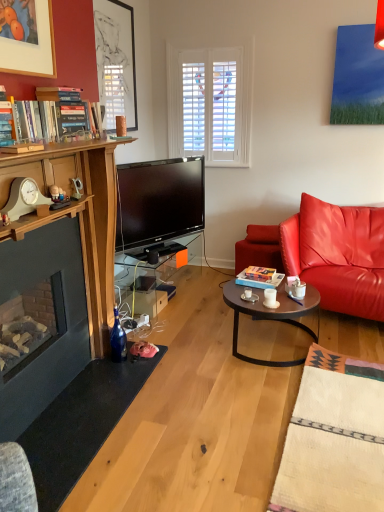
Question: Can you confirm if transparent glass table at center is bigger than hardcover book at center, the first book when ordered from bottom to top?

Choices:
 (A) no
 (B) yes

Answer: (B)

Question: Is transparent glass table at center taller than hardcover book at center, acting as the first book starting from the right?

Choices:
 (A) yes
 (B) no

Answer: (A)

Question: Is transparent glass table at center not inside hardcover book at center, which is the 2th book from front to back?

Choices:
 (A) yes
 (B) no

Answer: (A)

Question: Is transparent glass table at center to the left of hardcover book at center, marked as the 2th book in a top-to-bottom arrangement, from the viewer's perspective?

Choices:
 (A) no
 (B) yes

Answer: (B)

Question: From the image's perspective, is transparent glass table at center below hardcover book at center, the first book when ordered from bottom to top?

Choices:
 (A) yes
 (B) no

Answer: (B)

Question: Is blue glass bottle at lower left bigger or smaller than transparent glass table at center?

Choices:
 (A) big
 (B) small

Answer: (B)

Question: Is blue glass bottle at lower left wider or thinner than transparent glass table at center?

Choices:
 (A) thin
 (B) wide

Answer: (A)

Question: Would you say blue glass bottle at lower left is to the left or to the right of transparent glass table at center in the picture?

Choices:
 (A) left
 (B) right

Answer: (A)

Question: Is point click(115, 310) positioned closer to the camera than point click(160, 242)?

Choices:
 (A) closer
 (B) farther

Answer: (A)

Question: From a real-world perspective, is white wooden clock at left above or below hardcover books at left, positioned as the 2th book in right-to-left order?

Choices:
 (A) below
 (B) above

Answer: (A)

Question: From the image's perspective, is white wooden clock at left positioned above or below hardcover books at left, which appears as the first book when viewed from the left?

Choices:
 (A) above
 (B) below

Answer: (B)

Question: Does point (13, 186) appear closer or farther from the camera than point (46, 123)?

Choices:
 (A) closer
 (B) farther

Answer: (A)

Question: In the image, is white wooden clock at left positioned in front of or behind hardcover books at left, positioned as the 2th book in right-to-left order?

Choices:
 (A) behind
 (B) front

Answer: (B)

Question: Is blue glass bottle at lower left situated inside hardcover book at center, which is the 2th book in left-to-right order, or outside?

Choices:
 (A) outside
 (B) inside

Answer: (A)

Question: From the image's perspective, is blue glass bottle at lower left above or below hardcover book at center, acting as the first book starting from the right?

Choices:
 (A) above
 (B) below

Answer: (B)